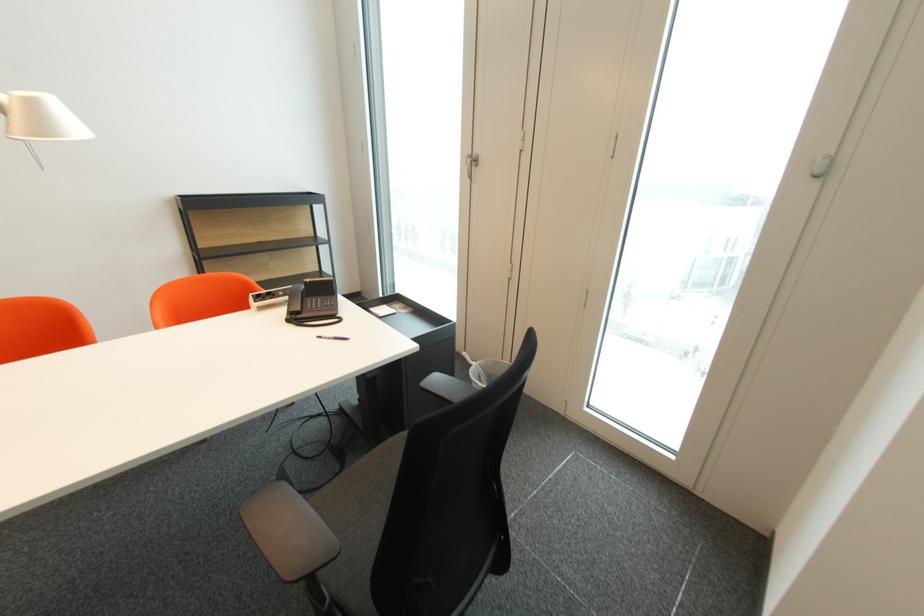
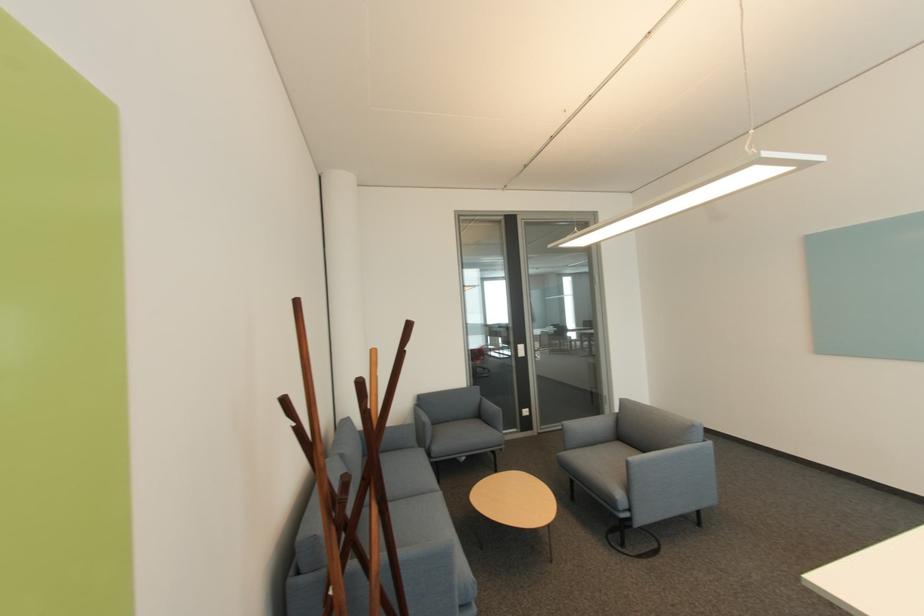
Question: The camera is either moving clockwise (left) or counter-clockwise (right) around the object. The first image is from the beginning of the video and the second image is from the end. Is the camera moving left or right when shooting the video?

Choices:
 (A) Left
 (B) Right

Answer: (B)